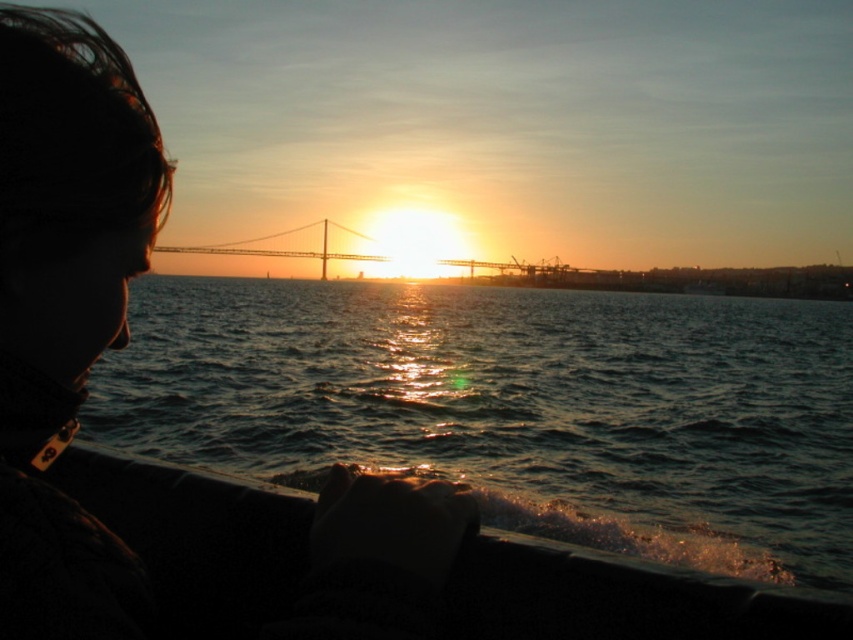
You are on a boat watching the sunset. You notice a point labeled as point (515, 406) in the image. Based on the scene description, what does this point most likely represent?

The point (515, 406) corresponds to glistening water at lower center.

In the scene shown: You are on a boat and want to take a photo of the glistening water at lower center and the metallic bridge at center. Which object appears closer to the camera in the photo?

The glistening water at lower center appears closer to the camera because it is shorter than the metallic bridge at center, making it seem nearer in the image.

You are on a boat watching the sunset and want to take a photo. There are two points in the scene marked as point 1 and point 2. Point 1 is at coordinates point (312, 285) and point 2 is at point (206, 244). Which point is closer to your camera lens?

Point 1 is closer to the camera lens because the description states that point (312, 285) is closer to the camera than point (206, 244).